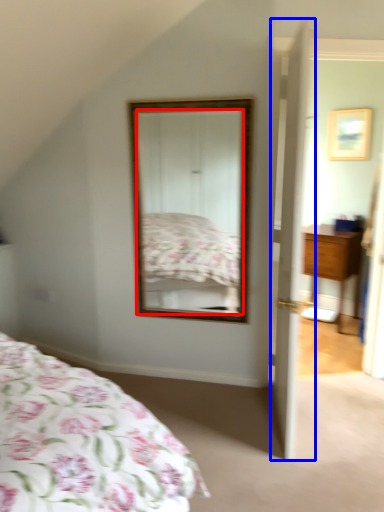
Question: Among these objects, which one is nearest to the camera, mirror (highlighted by a red box) or door (highlighted by a blue box)?

Choices:
 (A) mirror
 (B) door

Answer: (B)